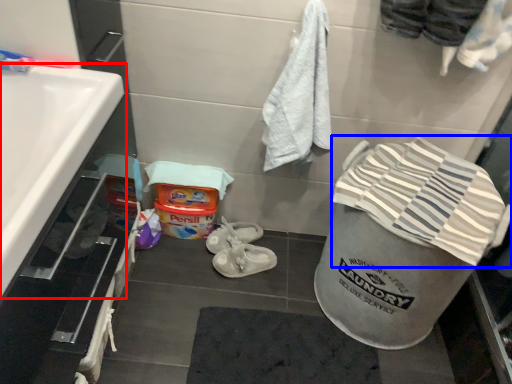
Question: Which object is further to the camera taking this photo, sink (highlighted by a red box) or beach towel (highlighted by a blue box)?

Choices:
 (A) sink
 (B) beach towel

Answer: (B)